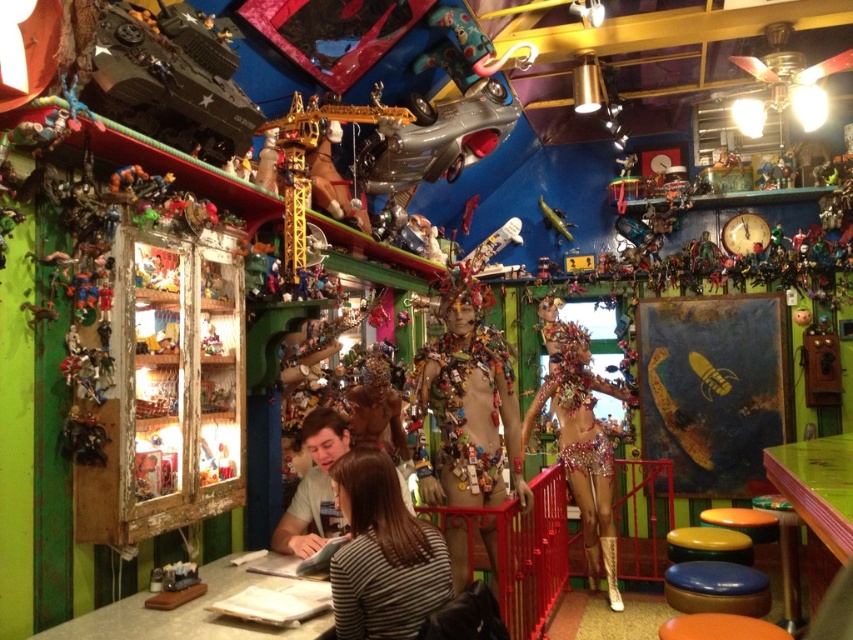
Question: Is metallic/textured mannequin at center bigger than green laminate table at lower left?

Choices:
 (A) no
 (B) yes

Answer: (B)

Question: Does orange plastic stool at lower right lie in front of yellow rubber stool at lower right?

Choices:
 (A) no
 (B) yes

Answer: (B)

Question: Estimate the real-world distances between objects in this image. Which object is farther from the metallic/textured mannequin at center?

Choices:
 (A) metallic silver airplane at center
 (B) orange plastic stool at lower right
 (C) green wood table at lower right
 (D) striped fabric shirt at center

Answer: (A)

Question: Which point is closer to the camera?

Choices:
 (A) green laminate table at lower left
 (B) metallic/textured mannequin at center
 (C) striped fabric shirt at center

Answer: (C)

Question: Among these objects, which one is farthest from the camera?

Choices:
 (A) smooth brown skin at center
 (B) metallic/textured mannequin at center
 (C) yellow rubber stool at lower right
 (D) matte green plastic tank at upper left

Answer: (C)

Question: Does smooth brown skin at center appear under metallic silver airplane at center?

Choices:
 (A) no
 (B) yes

Answer: (B)